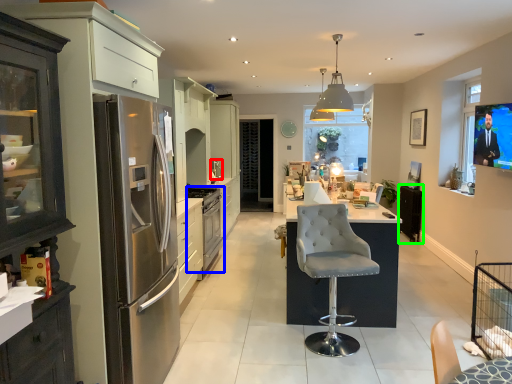
Question: Which object is positioned closest to appliance (highlighted by a red box)? Select from kitchen appliance (highlighted by a blue box) and appliance (highlighted by a green box).

Choices:
 (A) kitchen appliance
 (B) appliance

Answer: (A)